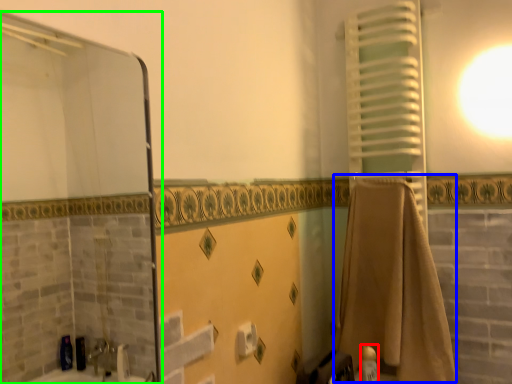
Question: Which is nearer to the toiletry (highlighted by a red box)? bath towel (highlighted by a blue box) or screen door (highlighted by a green box).

Choices:
 (A) bath towel
 (B) screen door

Answer: (A)